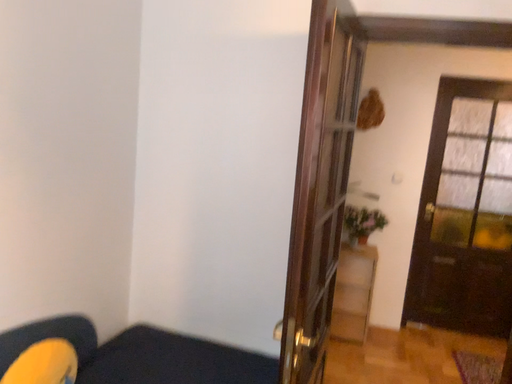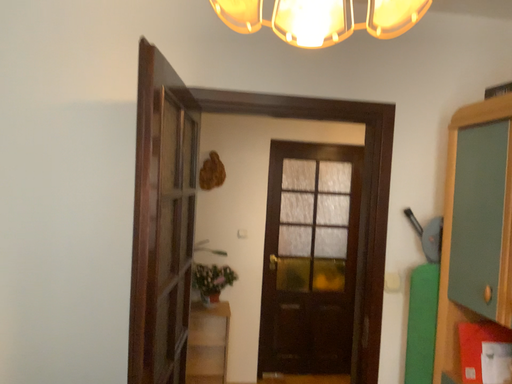
Question: Which way did the camera rotate in the video?

Choices:
 (A) rotated upward
 (B) rotated downward

Answer: (A)